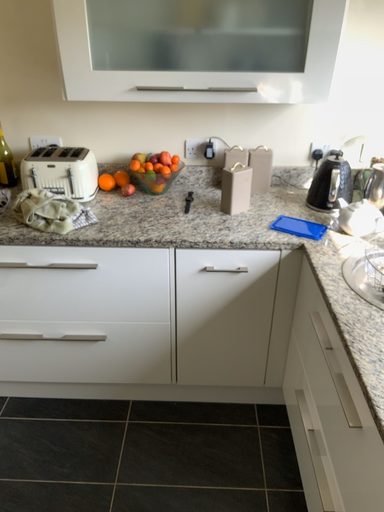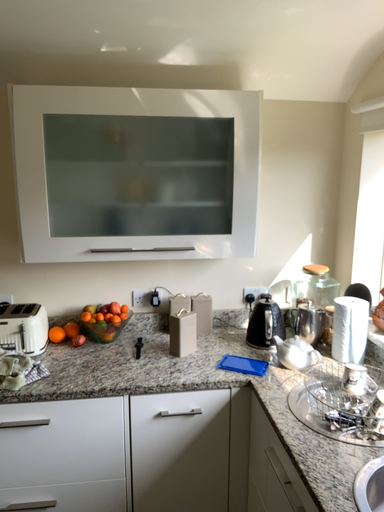
Question: How did the camera likely rotate when shooting the video?

Choices:
 (A) rotated right
 (B) rotated left

Answer: (A)